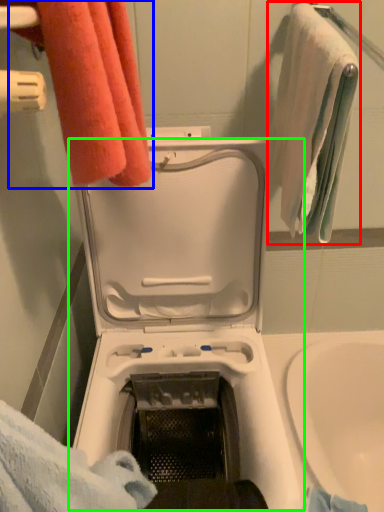
Question: Estimate the real-world distances between objects in this image. Which object is closer to towel (highlighted by a red box), towel (highlighted by a blue box) or washing machine (highlighted by a green box)?

Choices:
 (A) towel
 (B) washing machine

Answer: (B)